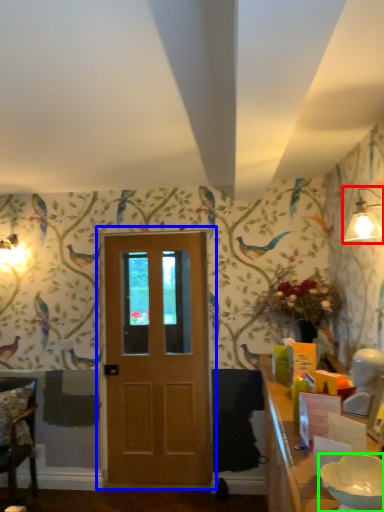
Question: Which is nearer to the light fixture (highlighted by a red box)? door (highlighted by a blue box) or bowl (highlighted by a green box).

Choices:
 (A) door
 (B) bowl

Answer: (B)